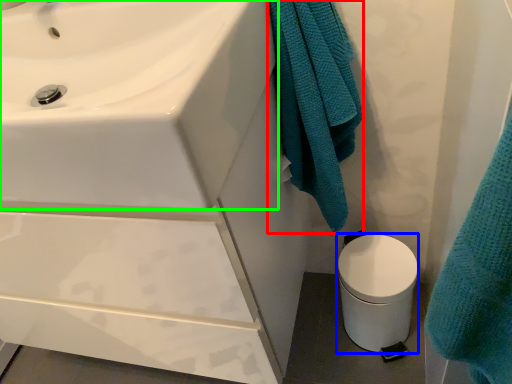
Question: Which is farther away from bath towel (highlighted by a red box)? toilet bowl (highlighted by a blue box) or sink (highlighted by a green box)?

Choices:
 (A) toilet bowl
 (B) sink

Answer: (A)